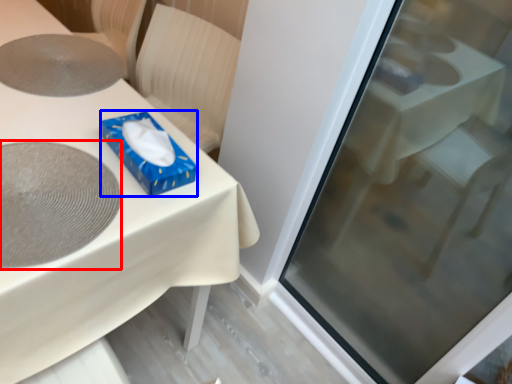
Question: Which of the following is the closest to the observer, oval (highlighted by a red box) or box (highlighted by a blue box)?

Choices:
 (A) oval
 (B) box

Answer: (A)